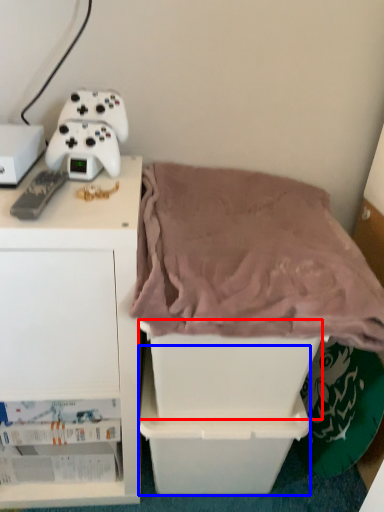
Question: Which object appears farthest to the camera in this image, storage box (highlighted by a red box) or storage box (highlighted by a blue box)?

Choices:
 (A) storage box
 (B) storage box

Answer: (B)